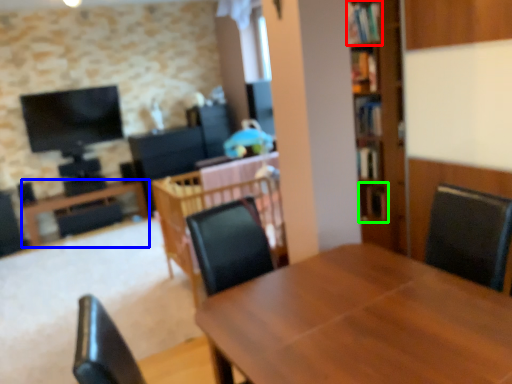
Question: Which is farther away from shelf (highlighted by a red box)? table (highlighted by a blue box) or shelf (highlighted by a green box)?

Choices:
 (A) table
 (B) shelf

Answer: (A)